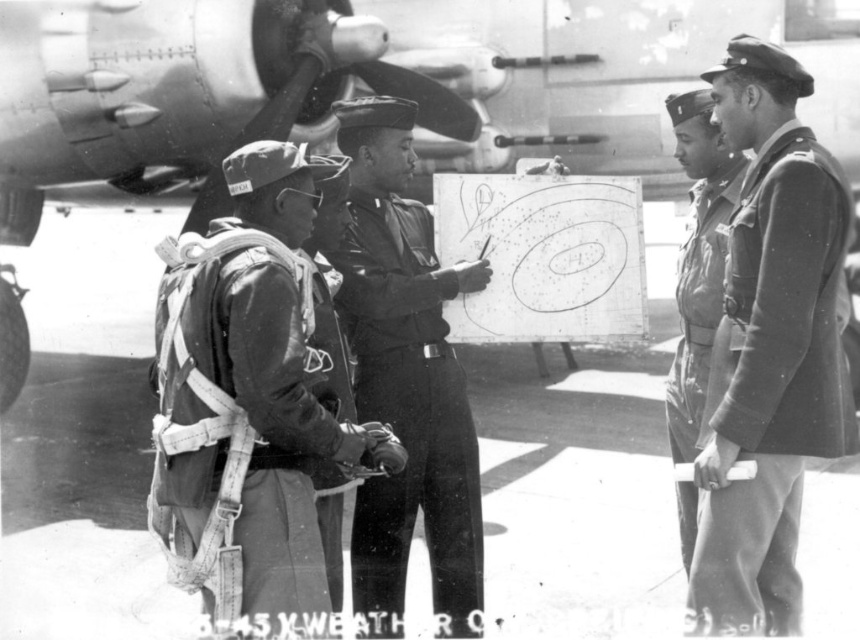
Question: Which point is closer to the camera?

Choices:
 (A) coord(226,419)
 (B) coord(729,172)
 (C) coord(793,572)

Answer: (A)

Question: Which object is closer to the camera taking this photo?

Choices:
 (A) camouflage fabric parachute at left
 (B) camouflage fabric uniform at right
 (C) metallic aircraft at center

Answer: (A)

Question: Is camouflage fabric parachute at left to the right of uniform fabric at right from the viewer's perspective?

Choices:
 (A) no
 (B) yes

Answer: (A)

Question: Is camouflage fabric uniform at right below brushed metal parachute harness at center?

Choices:
 (A) yes
 (B) no

Answer: (A)

Question: Which point is farther to the camera?

Choices:
 (A) uniform fabric at center
 (B) metallic aircraft at center
 (C) brushed metal parachute harness at center
 (D) uniform fabric at right

Answer: (B)

Question: Can you confirm if metallic aircraft at center is thinner than camouflage fabric uniform at right?

Choices:
 (A) no
 (B) yes

Answer: (A)